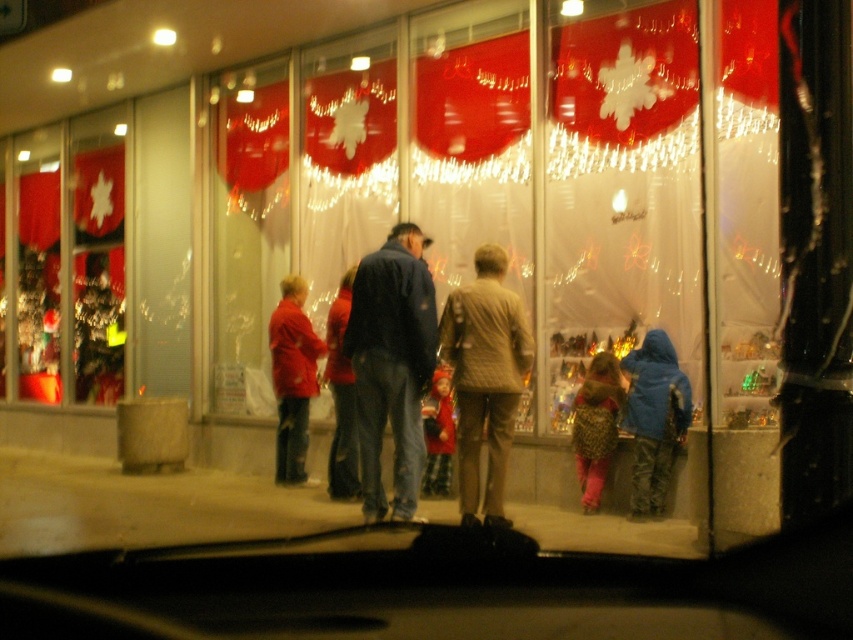
Question: Does translucent plastic display at center have a larger size compared to leopard print coat at center?

Choices:
 (A) yes
 (B) no

Answer: (A)

Question: Can you confirm if translucent plastic display at center is smaller than matte blue jacket at center?

Choices:
 (A) yes
 (B) no

Answer: (B)

Question: Considering the real-world distances, which object is closest to the translucent plastic display at center?

Choices:
 (A) velvet red coat at center
 (B) dark blue jacket at center
 (C) matte blue jacket at center

Answer: (A)

Question: Which object is closer to the camera taking this photo?

Choices:
 (A) leopard print coat at center
 (B) matte blue jacket at center
 (C) dark blue jacket at center
 (D) tan quilted jacket at center

Answer: (B)

Question: Is matte blue jacket at center bigger than dark blue jacket at center?

Choices:
 (A) no
 (B) yes

Answer: (A)

Question: Among these points, which one is farthest from the camera?

Choices:
 (A) (602, 432)
 (B) (442, 365)

Answer: (B)